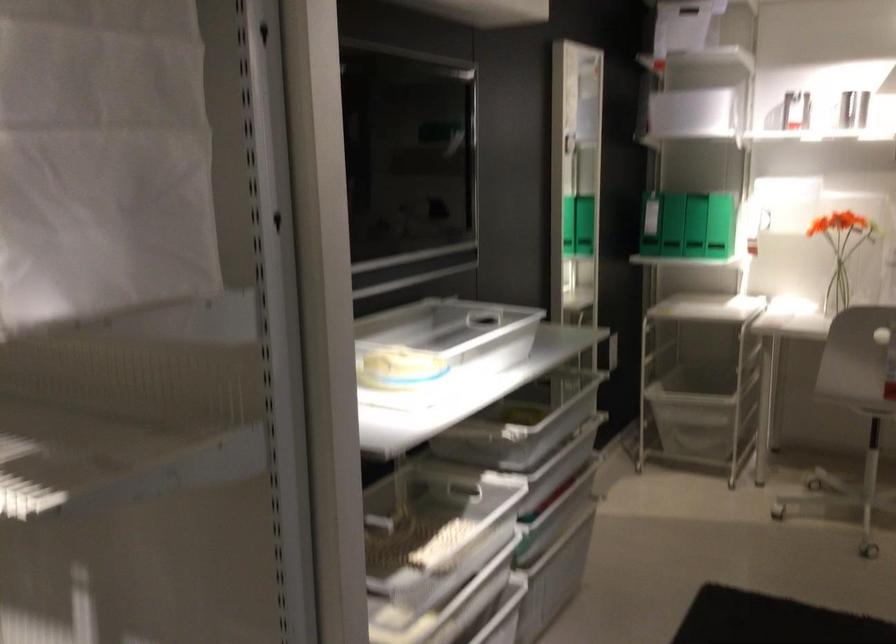
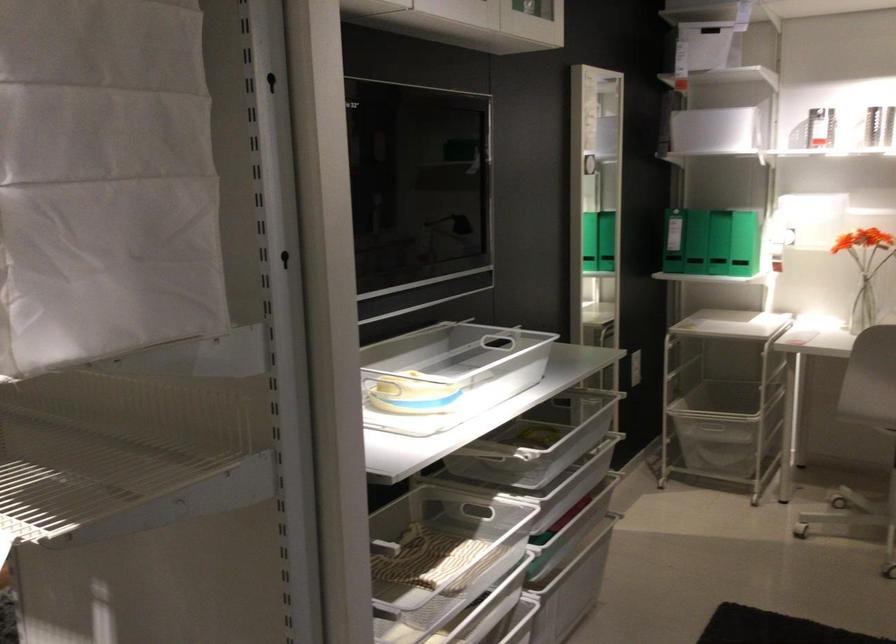
Find the pixel in the second image that matches [702,109] in the first image.

(716, 133)